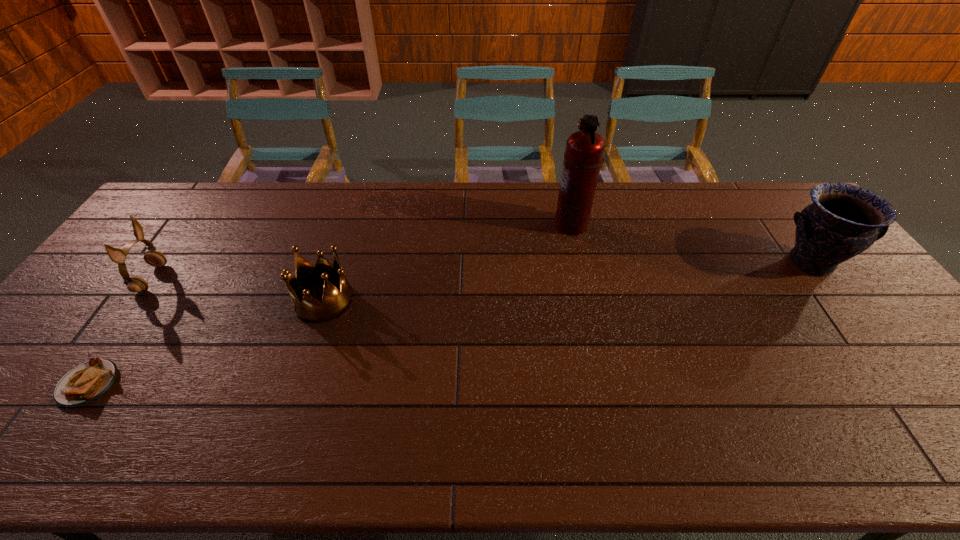
At what (x,y) coordinates should I click in order to perform the action: click on free space between the sandwich and the third object from left to right. Please return your answer as a coordinate pair (x, y). The height and width of the screenshot is (540, 960). Looking at the image, I should click on [206, 342].

At what (x,y) coordinates should I click in order to perform the action: click on vacant point located between the shortest object and the fourth shortest object. Please return your answer as a coordinate pair (x, y). The image size is (960, 540). Looking at the image, I should click on (449, 323).

Locate which object ranks fourth in proximity to the fourth shortest object. Please provide its 2D coordinates. Your answer should be formatted as a tuple, i.e. [(x, y)], where the tuple contains the x and y coordinates of a point satisfying the conditions above.

[(135, 284)]

Select which object is the closest to the fourth tallest object. Please provide its 2D coordinates. Your answer should be formatted as a tuple, i.e. [(x, y)], where the tuple contains the x and y coordinates of a point satisfying the conditions above.

[(87, 382)]

Where is `free space that satisfies the following two spatial constraints: 1. on the front-facing side of the third object from left to right; 2. on the left side of the third tallest object`? This screenshot has width=960, height=540. free space that satisfies the following two spatial constraints: 1. on the front-facing side of the third object from left to right; 2. on the left side of the third tallest object is located at coordinates (136, 300).

Find the location of a particular element. vacant space that satisfies the following two spatial constraints: 1. on the front-facing side of the third object from right to left; 2. on the right side of the earphone is located at coordinates (136, 300).